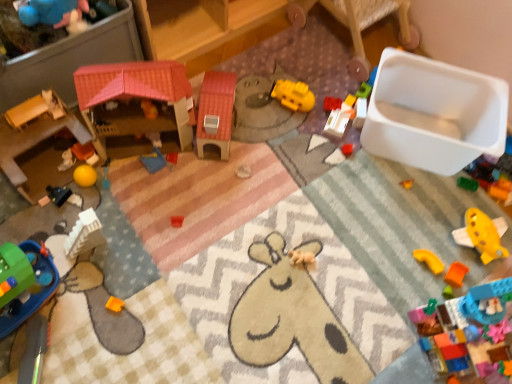
Find the location of a particular element. free space between yellow matte plastic arch at lower right, acting as the 4th toy starting from the right, and black plastic toy at lower left, the 13th toy from the right is located at coordinates (257, 235).